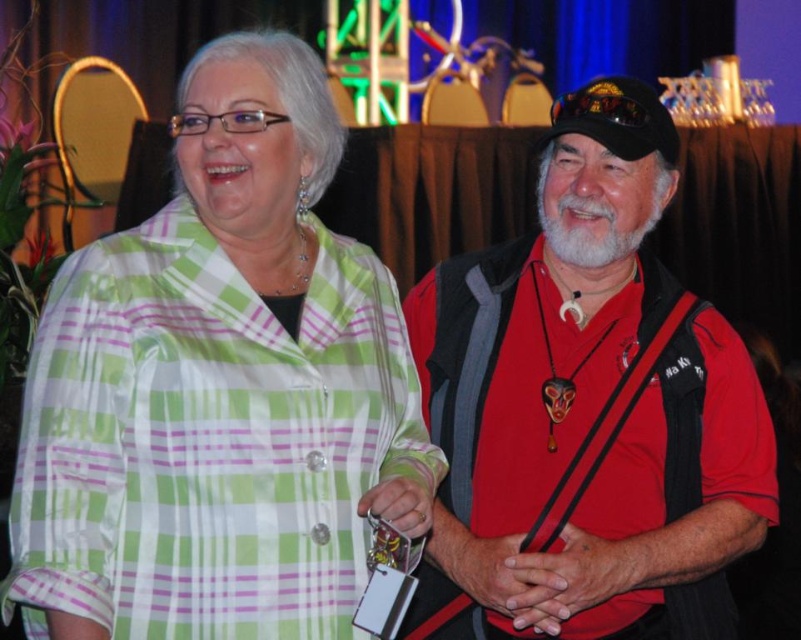
Question: Among these objects, which one is farthest from the camera?

Choices:
 (A) red matte vest at right
 (B) green plaid shirt at upper left

Answer: (A)

Question: Does green plaid shirt at upper left appear over red matte vest at right?

Choices:
 (A) no
 (B) yes

Answer: (B)

Question: Does green plaid shirt at upper left appear on the right side of red matte vest at right?

Choices:
 (A) no
 (B) yes

Answer: (A)

Question: Among these objects, which one is nearest to the camera?

Choices:
 (A) red matte vest at right
 (B) green plaid shirt at upper left

Answer: (B)

Question: Can you confirm if green plaid shirt at upper left is thinner than red matte vest at right?

Choices:
 (A) yes
 (B) no

Answer: (A)